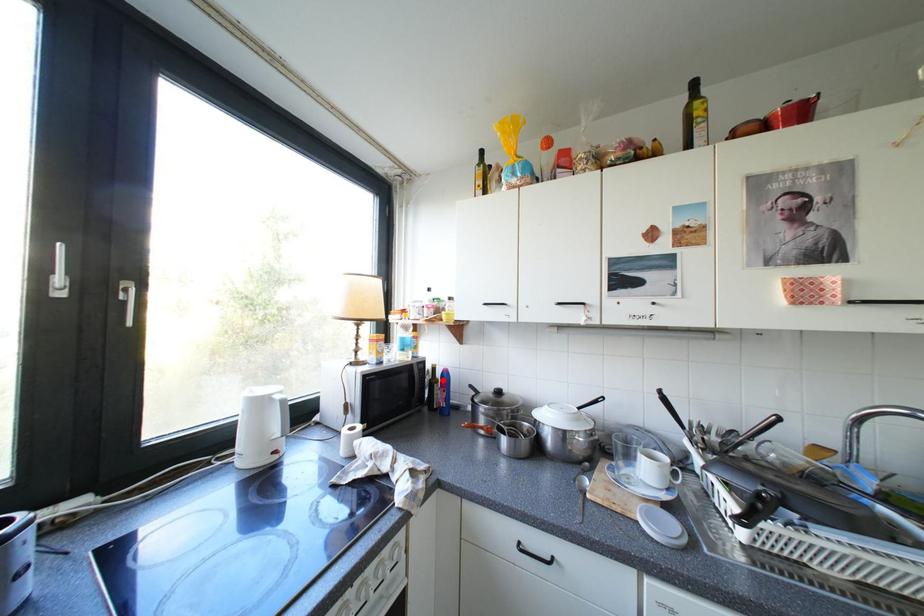
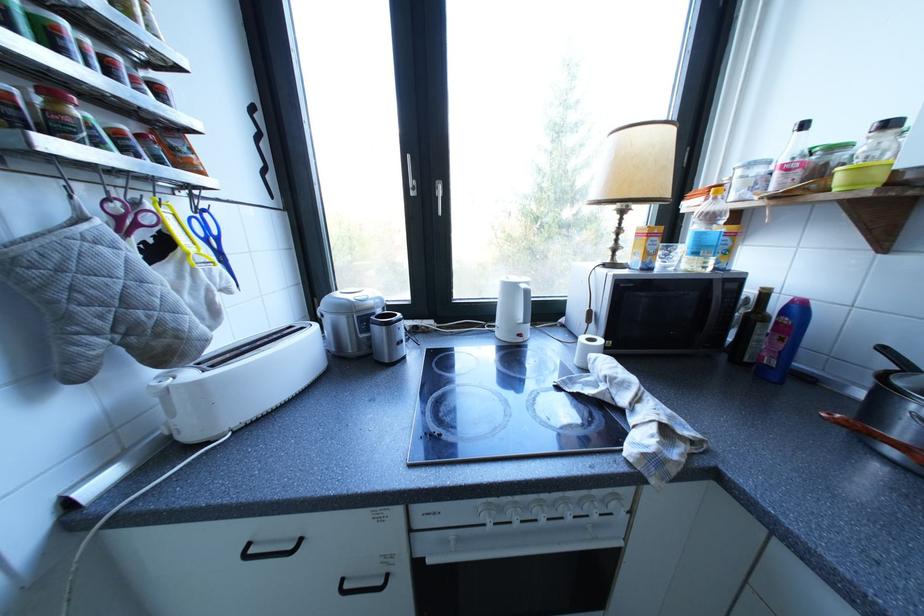
Locate, in the second image, the point that corresponds to the highlighted location in the first image.

(760, 315)